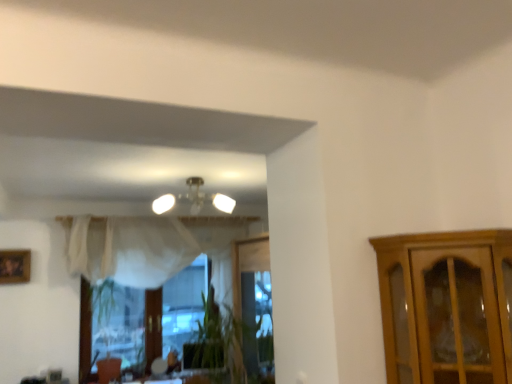
Question: In terms of width, does wooden framed photo at lower left look wider or thinner when compared to matte white chandelier at upper center?

Choices:
 (A) wide
 (B) thin

Answer: (B)

Question: From the image's perspective, is wooden framed photo at lower left above or below matte white chandelier at upper center?

Choices:
 (A) below
 (B) above

Answer: (A)

Question: From a real-world perspective, is wooden framed photo at lower left physically located above or below matte white chandelier at upper center?

Choices:
 (A) above
 (B) below

Answer: (B)

Question: Would you say matte white chandelier at upper center is inside or outside wooden framed photo at lower left?

Choices:
 (A) inside
 (B) outside

Answer: (B)

Question: From the image's perspective, is matte white chandelier at upper center located above or below wooden framed photo at lower left?

Choices:
 (A) below
 (B) above

Answer: (B)

Question: From a real-world perspective, relative to wooden framed photo at lower left, is matte white chandelier at upper center vertically above or below?

Choices:
 (A) below
 (B) above

Answer: (B)

Question: Considering the positions of matte white chandelier at upper center and wooden framed photo at lower left in the image, is matte white chandelier at upper center bigger or smaller than wooden framed photo at lower left?

Choices:
 (A) small
 (B) big

Answer: (B)